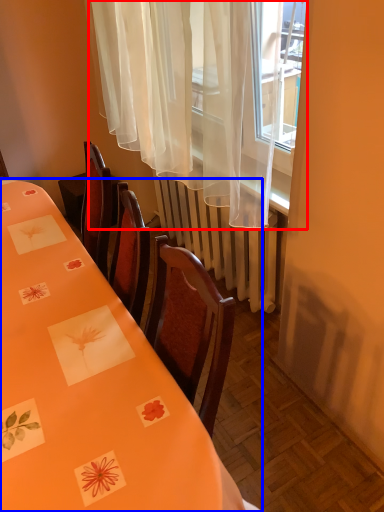
Question: Which point is closer to the camera, curtain (highlighted by a red box) or table (highlighted by a blue box)?

Choices:
 (A) curtain
 (B) table

Answer: (B)